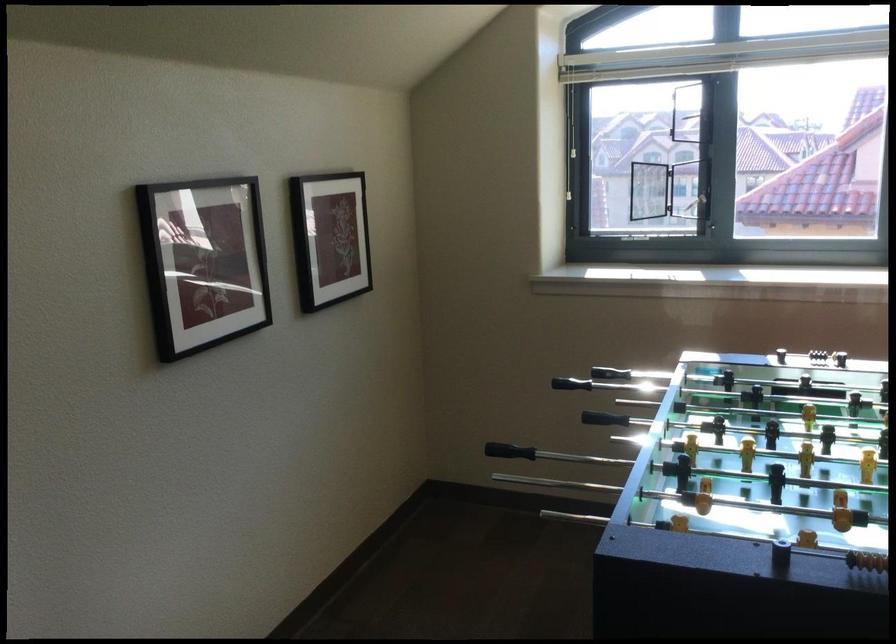
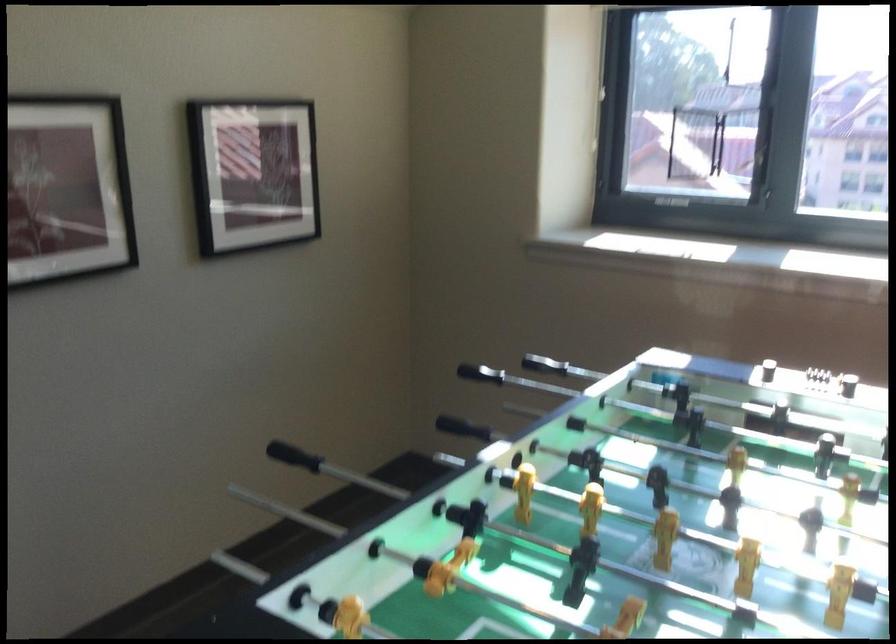
In the second image, find the point that corresponds to point (502, 386) in the first image.

(479, 373)